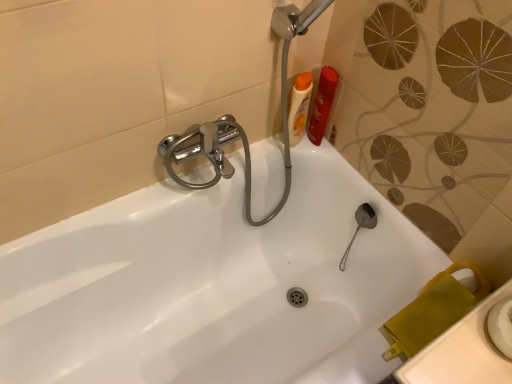
Question: Does point (293, 87) appear closer or farther from the camera than point (322, 92)?

Choices:
 (A) closer
 (B) farther

Answer: (A)

Question: From the image's perspective, is matte plastic bottles at upper right, the 1th toiletry from the left, located above or below orange plastic shampoo bottle at upper right, acting as the 1th toiletry starting from the right?

Choices:
 (A) below
 (B) above

Answer: (A)

Question: Visually, is matte plastic bottles at upper right, the 1th toiletry from the left, positioned to the left or to the right of orange plastic shampoo bottle at upper right, marked as the 2th toiletry in a left-to-right arrangement?

Choices:
 (A) left
 (B) right

Answer: (A)

Question: From a real-world perspective, relative to matte plastic bottles at upper right, the 1th toiletry from the left, is orange plastic shampoo bottle at upper right, marked as the 2th toiletry in a left-to-right arrangement, vertically above or below?

Choices:
 (A) below
 (B) above

Answer: (A)

Question: Considering the positions of orange plastic shampoo bottle at upper right, marked as the 2th toiletry in a left-to-right arrangement, and matte plastic bottles at upper right, which is counted as the second toiletry, starting from the right, in the image, is orange plastic shampoo bottle at upper right, marked as the 2th toiletry in a left-to-right arrangement, bigger or smaller than matte plastic bottles at upper right, which is counted as the second toiletry, starting from the right,?

Choices:
 (A) big
 (B) small

Answer: (B)

Question: Is orange plastic shampoo bottle at upper right, marked as the 2th toiletry in a left-to-right arrangement, wider or thinner than matte plastic bottles at upper right, the 1th toiletry from the left?

Choices:
 (A) wide
 (B) thin

Answer: (A)

Question: Is orange plastic shampoo bottle at upper right, marked as the 2th toiletry in a left-to-right arrangement, inside or outside of matte plastic bottles at upper right, which is counted as the second toiletry, starting from the right?

Choices:
 (A) inside
 (B) outside

Answer: (B)